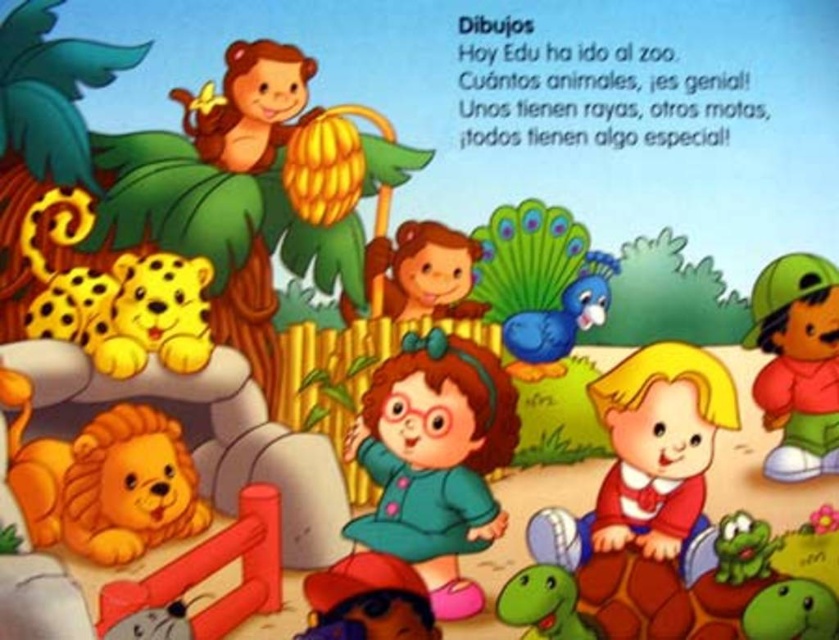
Question: Which object appears closest to the camera in this image?

Choices:
 (A) green rubber turtle at lower center
 (B) green matte teddy bear at right

Answer: (B)

Question: Can you confirm if golden plush lion at lower left is bigger than blue matte bird at center?

Choices:
 (A) yes
 (B) no

Answer: (A)

Question: Which point is farther from the camera taking this photo?

Choices:
 (A) [x=480, y=458]
 (B) [x=113, y=461]
 (C) [x=296, y=636]

Answer: (A)

Question: Does orange matte monkey at upper left have a greater width compared to yellow matte leopard at lower left?

Choices:
 (A) yes
 (B) no

Answer: (A)

Question: Which of the following is the closest to the observer?

Choices:
 (A) matte brown monkey at upper left
 (B) green matte teddy bear at right
 (C) blue matte bird at center

Answer: (B)

Question: Considering the relative positions of smooth blonde hair at center and green rubber turtle at lower center in the image provided, where is smooth blonde hair at center located with respect to green rubber turtle at lower center?

Choices:
 (A) below
 (B) above

Answer: (B)